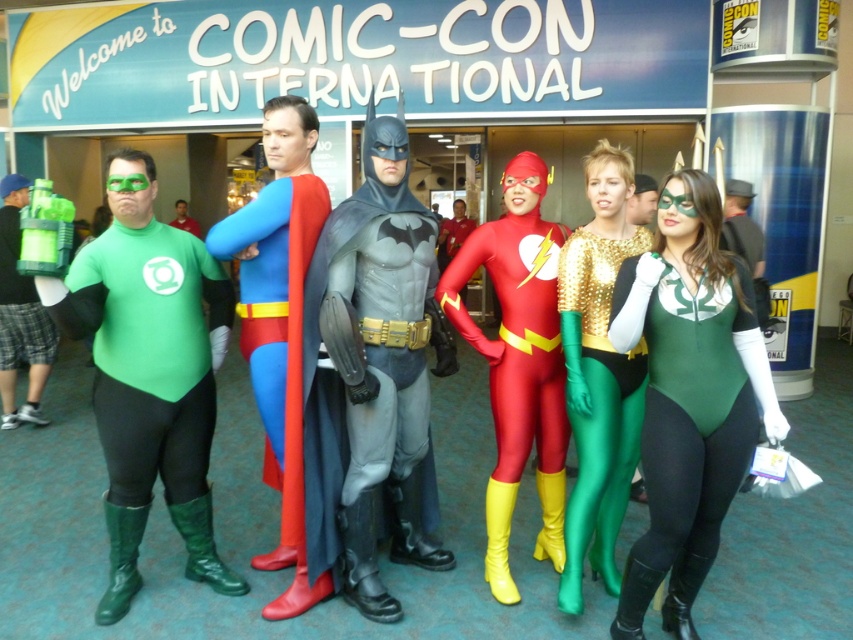
Which of these two, matte green backpack at left or green matte costume at center, stands taller?

matte green backpack at left is taller.

You are a GUI agent. You are given a task and a screenshot of the screen. Output one action in this format:
    pyautogui.click(x=<x>, y=<y>)
    Task: Click on the matte green backpack at left
    This screenshot has width=853, height=640.
    Given the screenshot: What is the action you would take?
    pyautogui.click(x=20, y=316)

Where is `matte green backpack at left`? This screenshot has width=853, height=640. matte green backpack at left is located at coordinates (20, 316).

Can you confirm if smooth gray suit at center is wider than green matte costume at center?

Incorrect, smooth gray suit at center's width does not surpass green matte costume at center's.

Can you confirm if smooth gray suit at center is bigger than green matte costume at center?

Correct, smooth gray suit at center is larger in size than green matte costume at center.

Find the location of `smooth gray suit at center`. smooth gray suit at center is located at coordinates (321, 346).

Can you confirm if green spandex bodysuit at center is positioned to the right of green matte costume at center?

Correct, you'll find green spandex bodysuit at center to the right of green matte costume at center.

Is green spandex bodysuit at center thinner than green matte costume at center?

Correct, green spandex bodysuit at center's width is less than green matte costume at center's.

Is point (722, 508) farther from viewer compared to point (199, 232)?

That is False.

Image resolution: width=853 pixels, height=640 pixels. I want to click on green spandex bodysuit at center, so click(x=689, y=419).